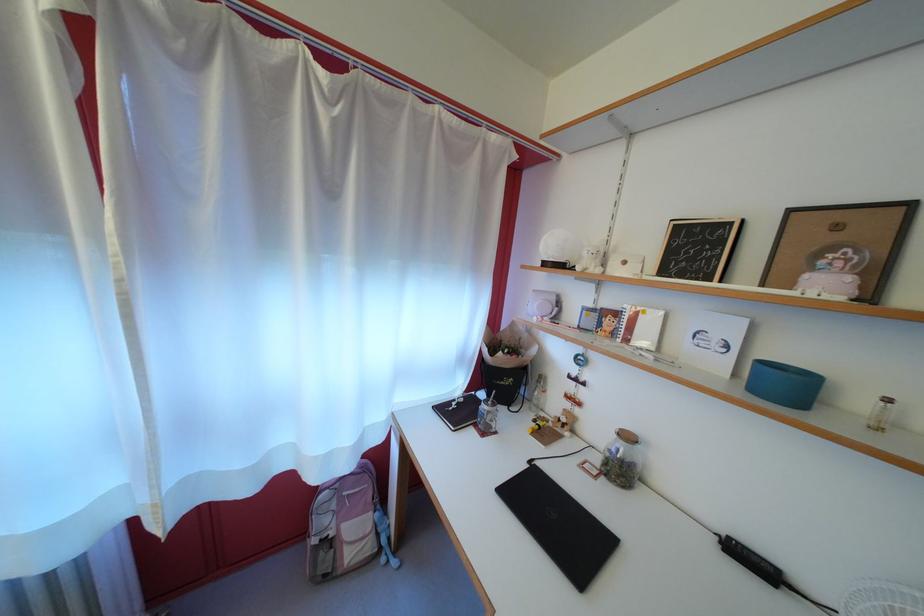
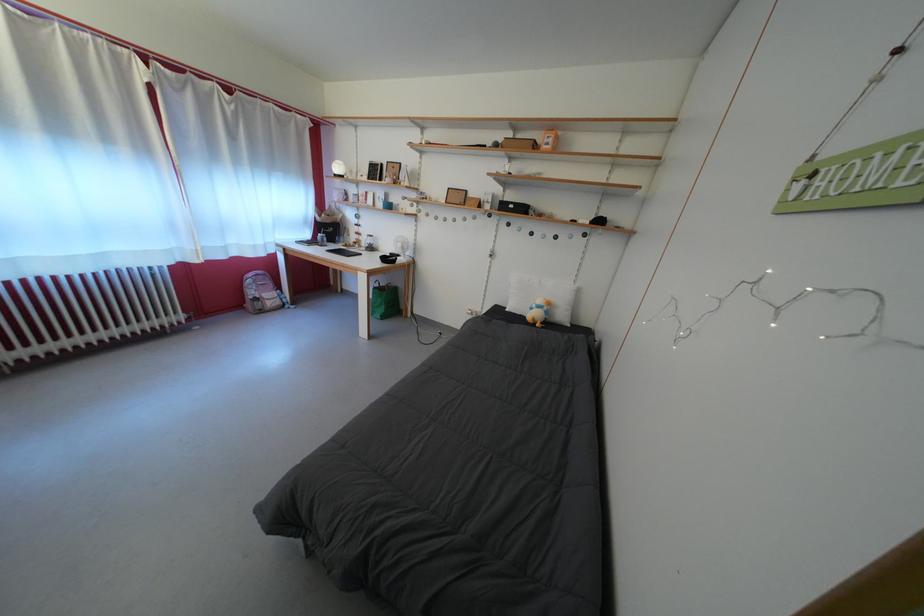
The point at (576,411) is marked in the first image. Where is the corresponding point in the second image?

(365, 243)